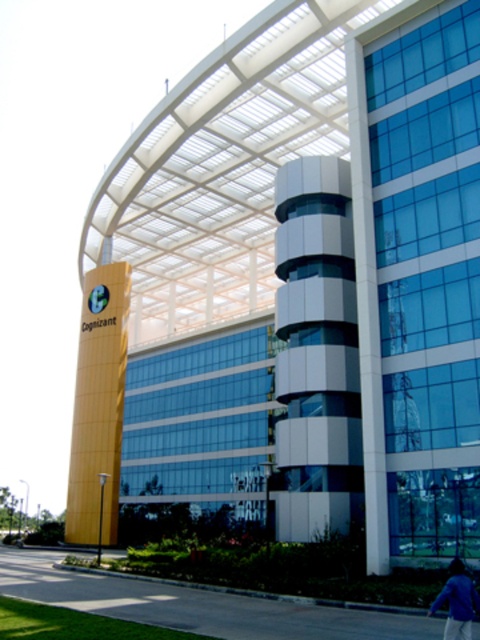
Question: Is smooth asphalt pavement at lower center bigger than blue fabric jacket at lower right?

Choices:
 (A) yes
 (B) no

Answer: (A)

Question: Can you confirm if smooth asphalt pavement at lower center is wider than blue fabric jacket at lower right?

Choices:
 (A) no
 (B) yes

Answer: (B)

Question: Which point is farther to the camera?

Choices:
 (A) smooth asphalt pavement at lower center
 (B) blue fabric jacket at lower right

Answer: (A)

Question: Which object appears farthest from the camera in this image?

Choices:
 (A) blue fabric jacket at lower right
 (B) smooth asphalt pavement at lower center

Answer: (B)

Question: Does smooth asphalt pavement at lower center have a larger size compared to blue fabric jacket at lower right?

Choices:
 (A) yes
 (B) no

Answer: (A)

Question: Which point is farther from the camera taking this photo?

Choices:
 (A) (476, 595)
 (B) (57, 595)

Answer: (B)